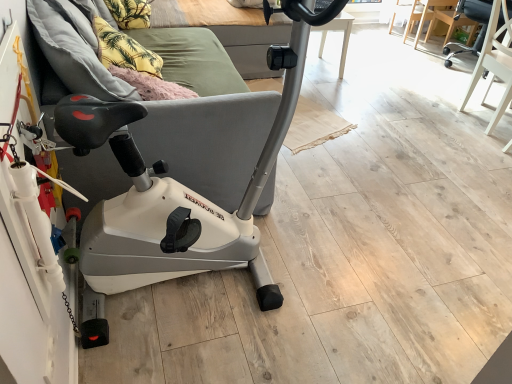
The height and width of the screenshot is (384, 512). In order to click on vacant area situated below black leather swivel chair at upper right, acting as the second swivel chair starting from the front (from a real-world perspective) in this screenshot , I will do `click(461, 58)`.